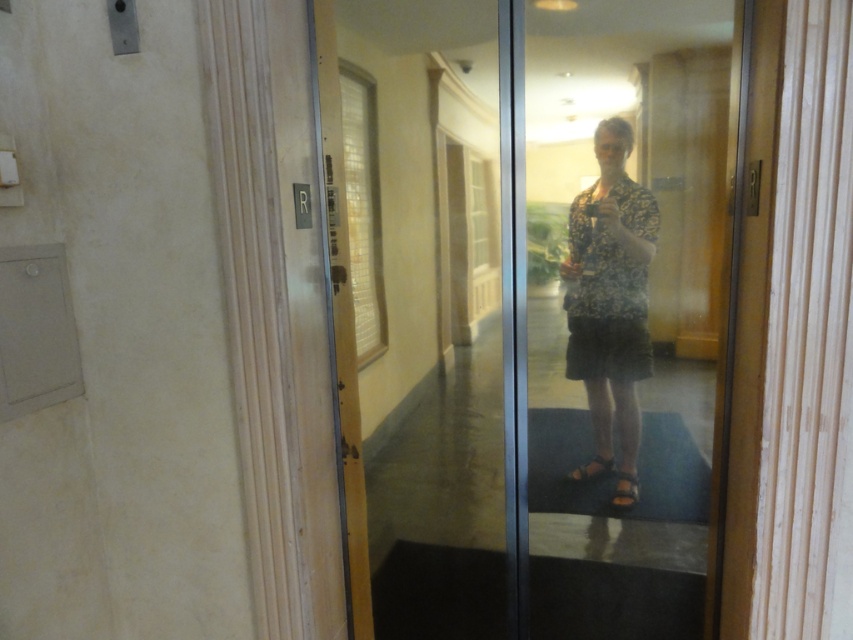
You are inside an elevator and want to press a button on the metallic panel. You notice two points marked on the panel. Which point is closer to you, point at coordinate (345,301) or point at coordinate (579,246)?

Point at coordinate (579,246) is closer to you because point at coordinate (345,301) is further to the camera than point at coordinate (579,246).